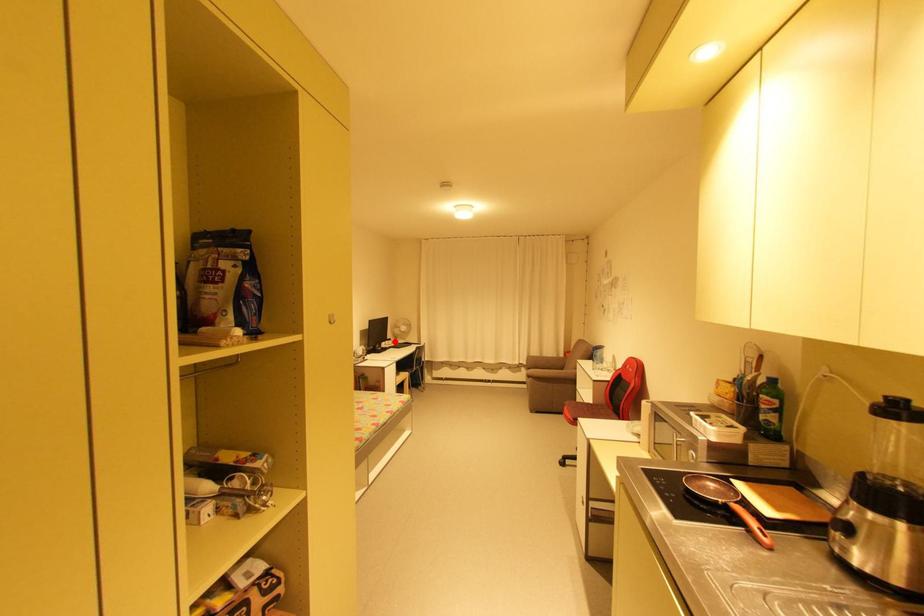
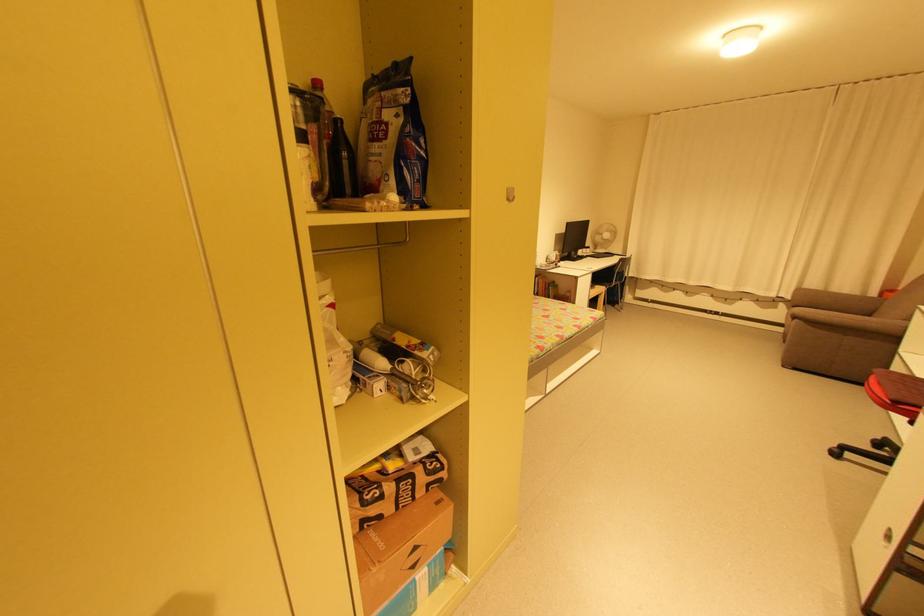
Find the pixel in the second image that matches the highlighted location in the first image.

(592, 249)